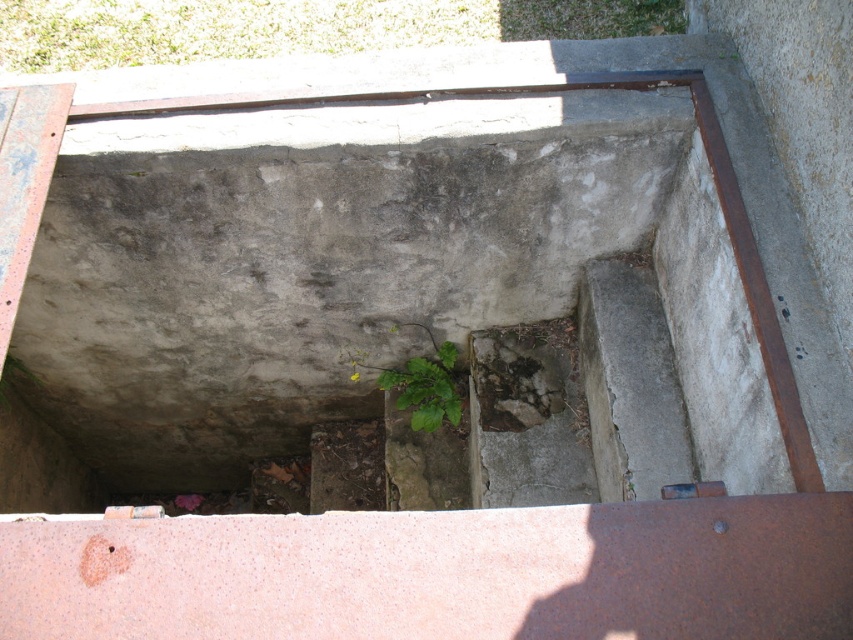
Is point (200, 1) closer to camera compared to point (537, 397)?

That is False.

Does green leafy plant at upper center appear on the left side of brown rough stone hole at center?

Yes, green leafy plant at upper center is to the left of brown rough stone hole at center.

Who is more forward, (73, 38) or (521, 328)?

Point (521, 328) is in front.

Locate an element on the screen. The image size is (853, 640). green leafy plant at upper center is located at coordinates (294, 28).

Does green leafy plant at upper center appear on the right side of green leafy plant at center?

No, green leafy plant at upper center is not to the right of green leafy plant at center.

Who is lower down, green leafy plant at upper center or green leafy plant at center?

green leafy plant at center is below.

Find the location of a particular element. green leafy plant at upper center is located at coordinates (294, 28).

Who is positioned more to the left, brown rough stone hole at center or green leafy plant at center?

Positioned to the left is green leafy plant at center.

Who is taller, brown rough stone hole at center or green leafy plant at center?

With more height is green leafy plant at center.

Is point (498, 352) more distant than point (390, 374)?

No, it is in front of (390, 374).

I want to click on brown rough stone hole at center, so click(x=515, y=376).